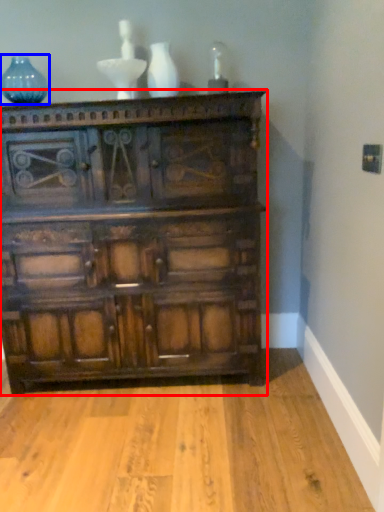
Question: Which object appears farthest to the camera in this image, chest of drawers (highlighted by a red box) or glass vase (highlighted by a blue box)?

Choices:
 (A) chest of drawers
 (B) glass vase

Answer: (B)